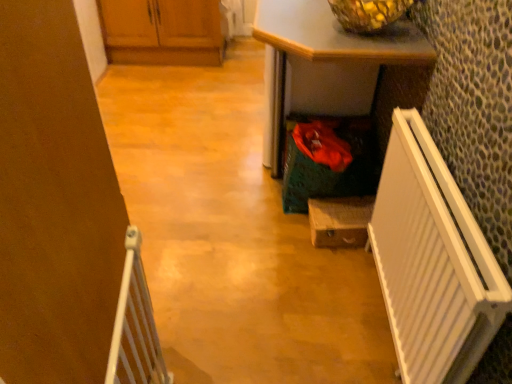
Locate an element on the screen. vacant space behind white plastic radiator at right, acting as the first radiator starting from the right is located at coordinates (311, 258).